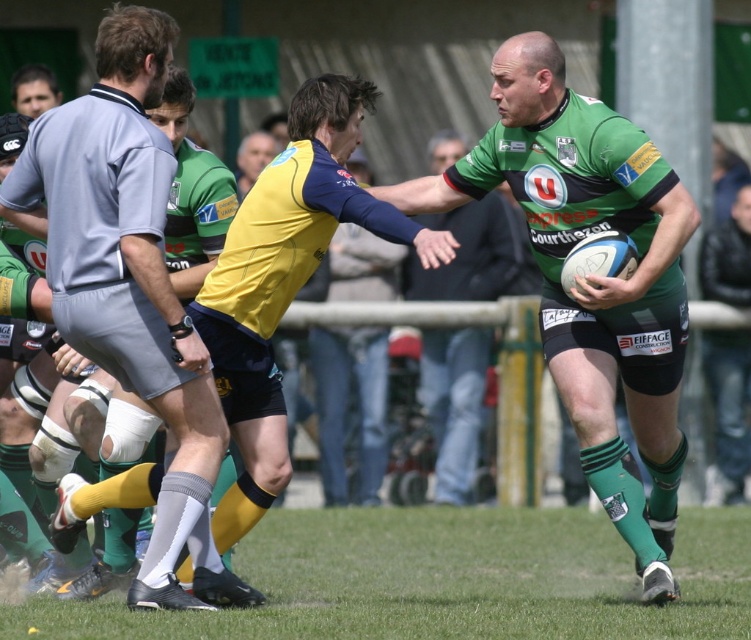
Can you confirm if yellow jersey at center is positioned to the right of green jersey at center?

No, yellow jersey at center is not to the right of green jersey at center.

Does yellow jersey at center have a greater width compared to green jersey at center?

Indeed, yellow jersey at center has a greater width compared to green jersey at center.

Identify the location of yellow jersey at center. (128, 278).

Locate an element on the screen. Image resolution: width=751 pixels, height=640 pixels. yellow jersey at center is located at coordinates (128, 278).

Which is more to the left, green matte rugby ball at center or yellow jersey at center?

Positioned to the left is yellow jersey at center.

Can you confirm if green matte rugby ball at center is shorter than yellow jersey at center?

Indeed, green matte rugby ball at center has a lesser height compared to yellow jersey at center.

Which is behind, point (685, 211) or point (137, 278)?

The point (685, 211) is more distant.

Where is `green matte rugby ball at center`? green matte rugby ball at center is located at coordinates (590, 276).

Is green matte rugby ball at center wider than smooth gray shirt at upper left?

Yes, green matte rugby ball at center is wider than smooth gray shirt at upper left.

Where is `green matte rugby ball at center`? This screenshot has width=751, height=640. green matte rugby ball at center is located at coordinates (590, 276).